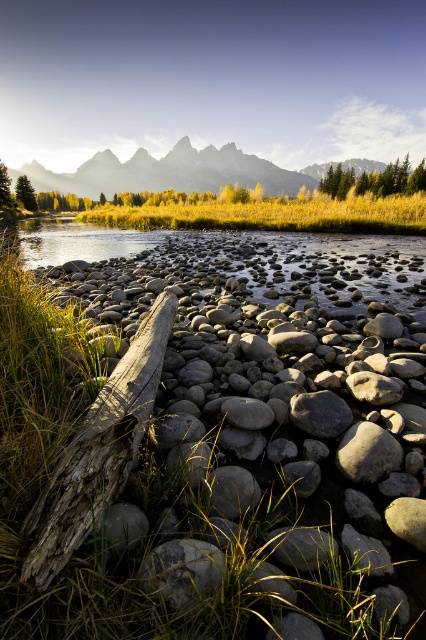
Question: Estimate the real-world distances between objects in this image. Which object is closer to the green matte tree at center?

Choices:
 (A) weathered wood log at center
 (B) green matte tree at center-left

Answer: (B)

Question: Which object is positioned farthest from the weathered wood log at center?

Choices:
 (A) smooth gray rock at lower center
 (B) silvery granite peaks at upper center
 (C) green matte tree at center

Answer: (B)

Question: Is weathered wood log at center thinner than green matte tree at center?

Choices:
 (A) no
 (B) yes

Answer: (B)

Question: Which object is farther from the camera taking this photo?

Choices:
 (A) green matte tree at center
 (B) green matte tree at center-left

Answer: (A)

Question: Does smooth gray rock at center have a greater width compared to green matte tree at center-left?

Choices:
 (A) no
 (B) yes

Answer: (A)

Question: Does smooth gray rock at center have a smaller size compared to smooth gray rock at lower center?

Choices:
 (A) no
 (B) yes

Answer: (A)